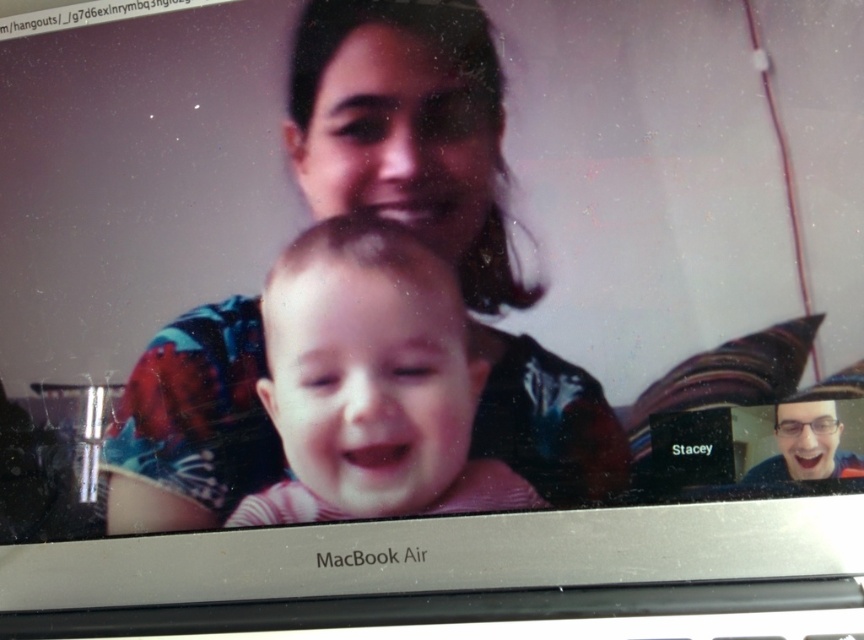
You are trying to locate the pink striped shirt at center on the MacBook Air screen. According to the coordinates provided, where exactly is it located?

The pink striped shirt at center is located at coordinates point (372,384).

You are holding a smartphone camera and want to take a photo of the MacBook Air screen to capture the video call interface. The point at coordinates point (360, 108) is crucial for framing the shot. If your smartphone camera is 33.96 inches away from this point, will you be able to capture the entire MacBook Air screen in your photo?

The point (360, 108) is 33.96 inches away from the camera. Since the MacBook Air screen is likely smaller than the field of view at this distance, you should be able to capture the entire screen in the photo.

You are a virtual assistant trying to describe the participants in a video call. You see the matte black shirt at center and the pink striped shirt at center. Which one is positioned to the left?

The matte black shirt at center is to the left of the pink striped shirt at center, so the matte black shirt at center is positioned to the left.